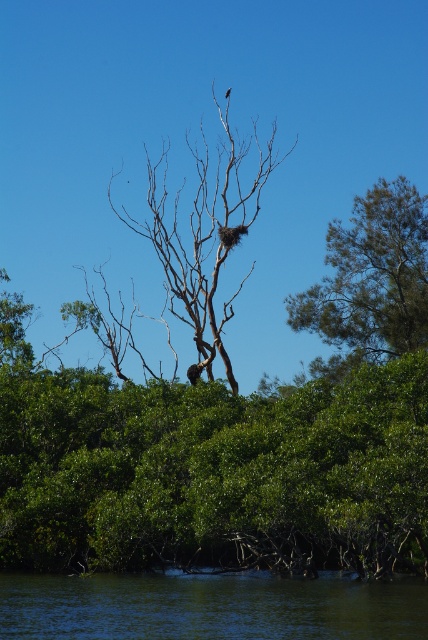
From the picture: You are standing in the natural scene and want to place a small flag at each of the two points, point (124,612) and point (269,170). Which point will require you to walk further to reach?

Point (269,170) will require you to walk further because it is farther from the viewer compared to point (124,612).